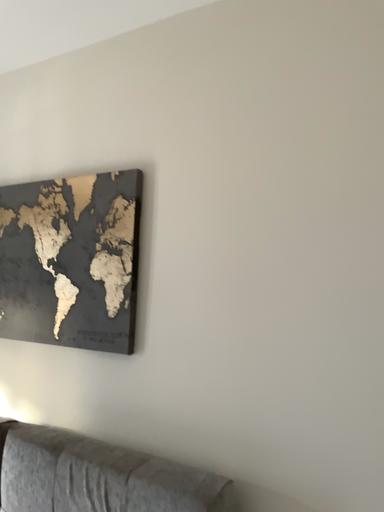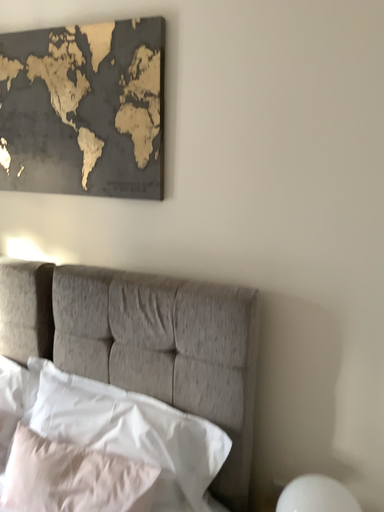
Question: How did the camera likely rotate when shooting the video?

Choices:
 (A) rotated downward
 (B) rotated upward

Answer: (A)